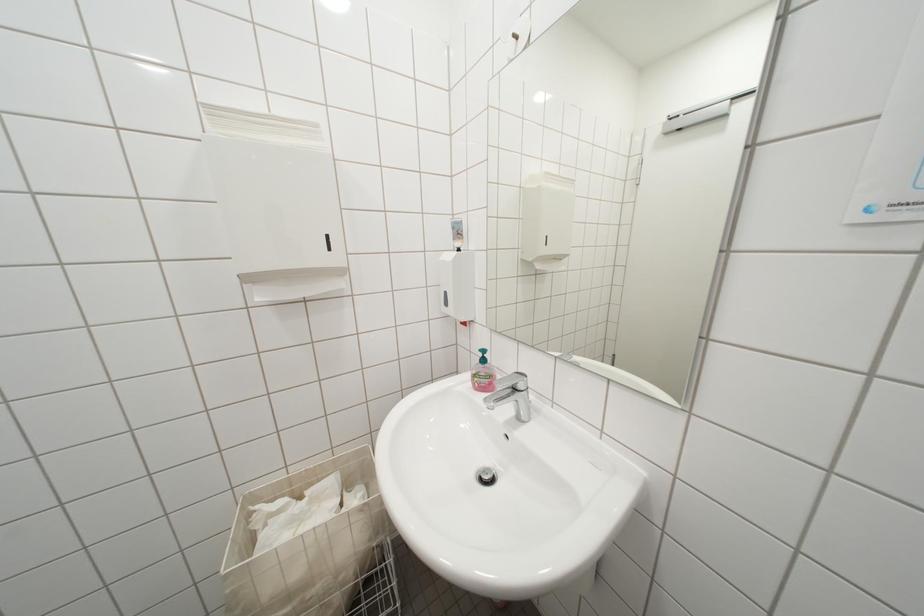
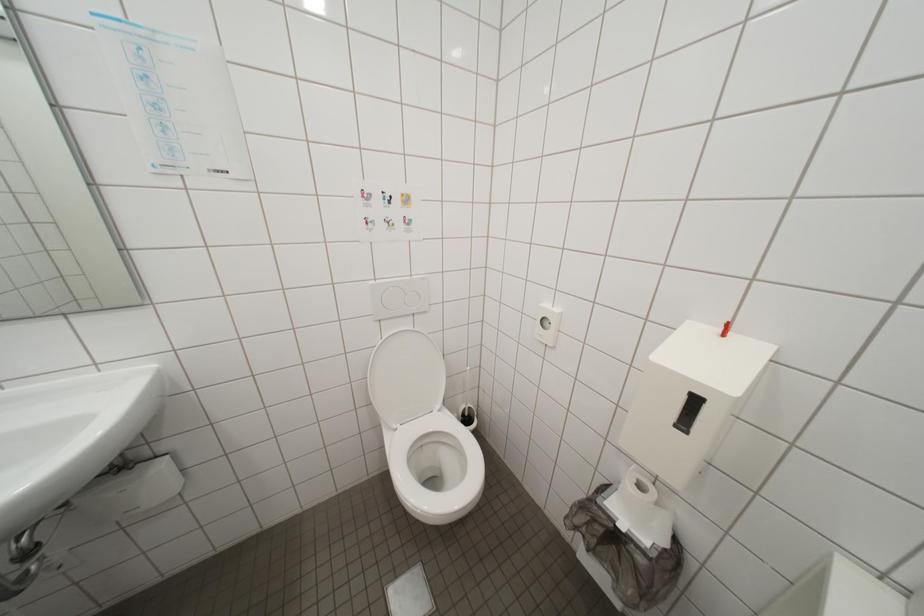
How did the camera likely rotate?

The camera rotated toward right-down.